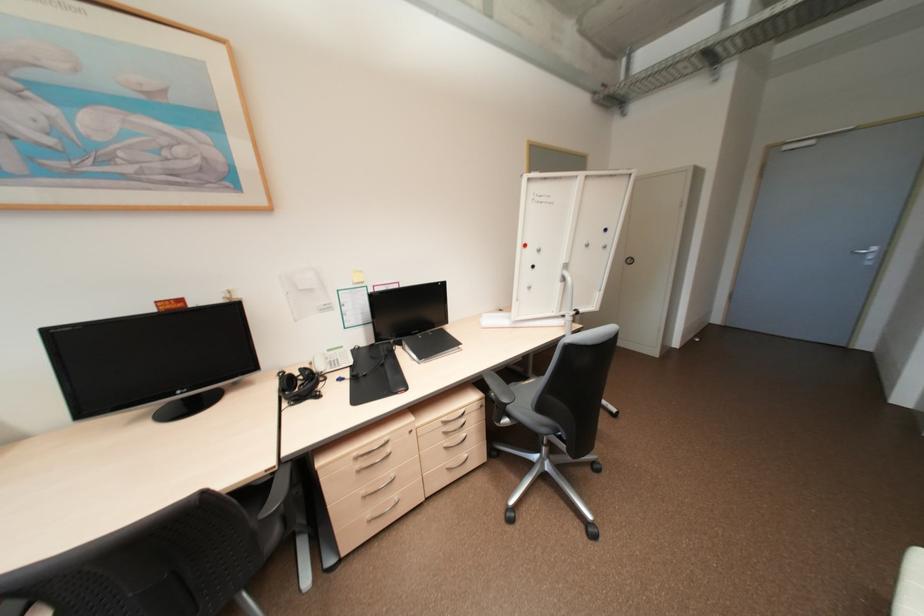
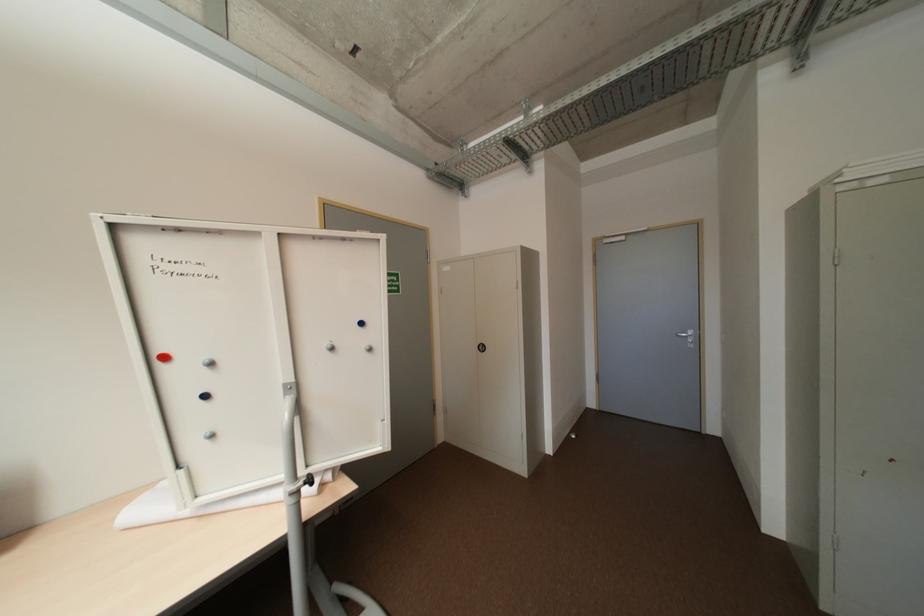
Which direction would the cameraman need to move to produce the second image?

The cameraman walked toward right, forward.